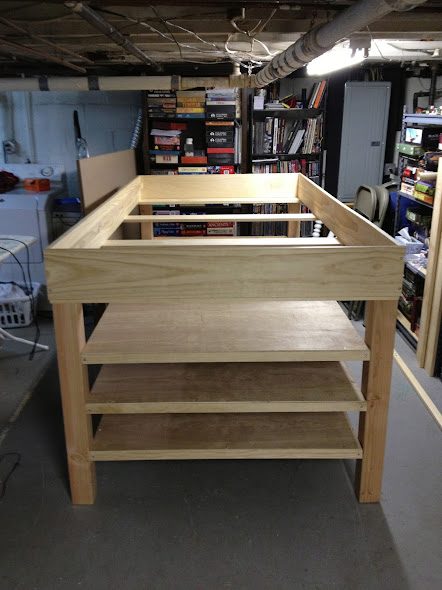
Find the location of a particular element. Image resolution: width=442 pixels, height=590 pixels. wooden leg is located at coordinates 71,416.